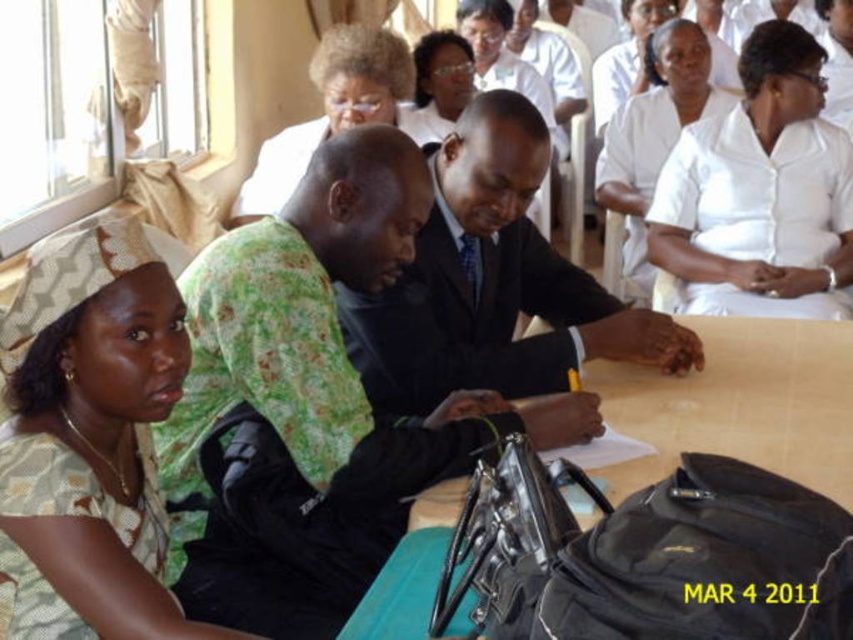
You are standing at point (604, 160) and want to walk to point (653, 440). Is there a clear path between these two points?

Yes, since point (653, 440) is in front of point (604, 160), there is a clear path between them.

You are a person who wants to place a small book on the wooden table at center. However, you notice the white smooth shirt at upper center is in the way. Can you still place the book on the table without moving the shirt?

The wooden table at center is not as tall as white smooth shirt at upper center, meaning the shirt is taller than the table. Therefore, the shirt might be blocking access to the table, making it difficult to place the book without moving the shirt.